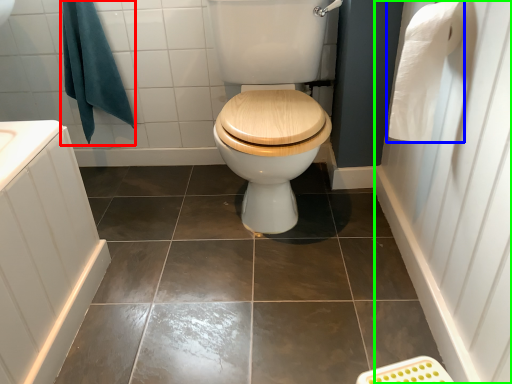
Question: Which is nearer to the bath towel (highlighted by a red box)? toilet paper (highlighted by a blue box) or side (highlighted by a green box).

Choices:
 (A) toilet paper
 (B) side

Answer: (A)